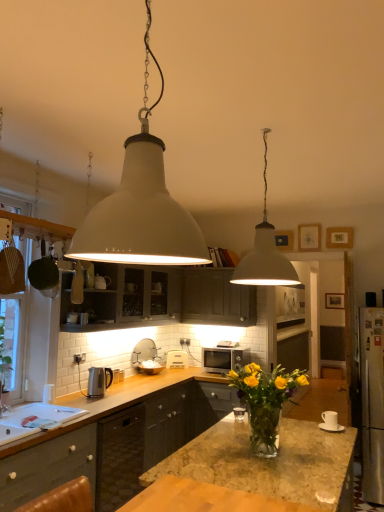
Question: In terms of width, does white matte microwave at center, the 1th appliance in the back-to-front sequence, look wider or thinner when compared to granite countertop at center?

Choices:
 (A) wide
 (B) thin

Answer: (B)

Question: Is white matte microwave at center, positioned as the second appliance in left-to-right order, inside the boundaries of granite countertop at center, or outside?

Choices:
 (A) inside
 (B) outside

Answer: (B)

Question: Which object is the closest to the polished stainless steel kettle at lower left, which appears as the 2th appliance when viewed from the right?

Choices:
 (A) wooden picture frame at upper right, marked as the 2th picture frame in a top-to-bottom arrangement
 (B) white matte microwave at center, positioned as the second appliance in left-to-right order
 (C) white matte pendant light at upper center, which is counted as the 1th lamp, starting from the left
 (D) white glossy sink at lower left
 (E) satin silver microwave at center

Answer: (D)

Question: Which is farther from the white glossy sink at lower left?

Choices:
 (A) white matte pendant light at upper center, which appears as the 1th lamp when viewed from the back
 (B) dark gray wood cabinet at center, which is the third cabinetry from front to back
 (C) matte gray cabinet at upper center, the 2th cabinetry positioned from the back
 (D) white matte pendant light at upper center, which ranks as the 1th lamp in front-to-back order
 (E) satin silver microwave at center

Answer: (B)